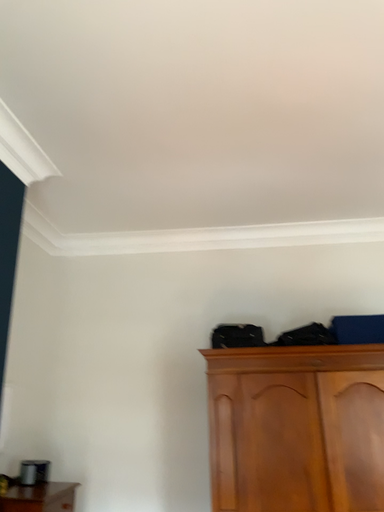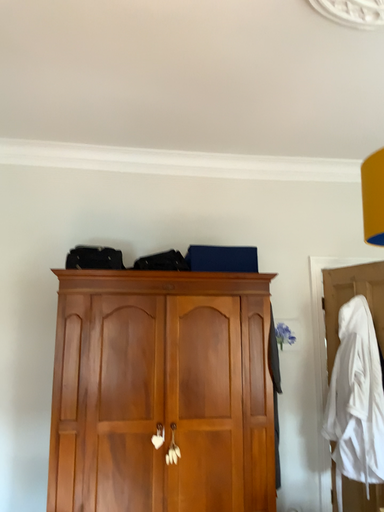
Question: How did the camera likely rotate when shooting the video?

Choices:
 (A) rotated downward
 (B) rotated upward

Answer: (A)